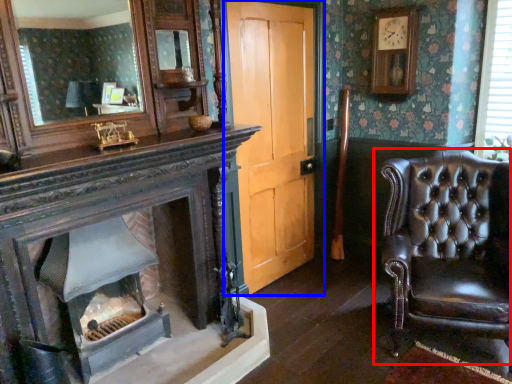
Question: Which object is further to the camera taking this photo, chair (highlighted by a red box) or door (highlighted by a blue box)?

Choices:
 (A) chair
 (B) door

Answer: (B)